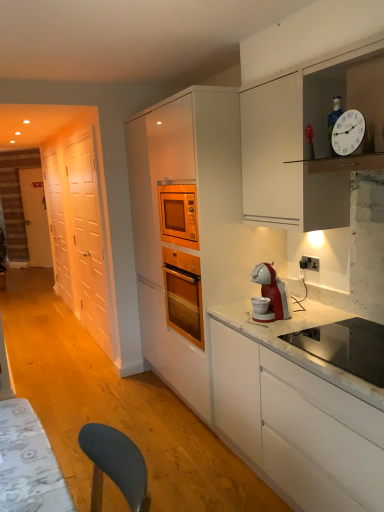
Measure the distance between stainless steel sink at lower right and camera.

stainless steel sink at lower right is 1.52 meters from camera.

At what (x,y) coordinates should I click in order to perform the action: click on white glossy door at left, the first glass door from the left. Please return your answer as a coordinate pair (x, y). This screenshot has height=512, width=384. Looking at the image, I should click on (57, 227).

What is the approximate height of white plastic clock at upper right?

It is 19.07 centimeters.

Identify the location of matte white cabinetry at center. The width and height of the screenshot is (384, 512). (199, 222).

Describe the element at coordinates (199, 222) in the screenshot. I see `matte white cabinetry at center` at that location.

Where is `stainless steel sink at lower right`? stainless steel sink at lower right is located at coordinates coord(346,346).

Is white wooden door at left facing towards white glossy door at left, marked as the first glass door in a front-to-back arrangement?

No, white wooden door at left is not aimed at white glossy door at left, marked as the first glass door in a front-to-back arrangement.

Which of these two, white wooden door at left or white glossy door at left, marked as the first glass door in a front-to-back arrangement, is smaller?

white glossy door at left, marked as the first glass door in a front-to-back arrangement, is smaller.

Is white wooden door at left not close to white glossy door at left, positioned as the 2th glass door in left-to-right order?

Indeed, white wooden door at left is not near white glossy door at left, positioned as the 2th glass door in left-to-right order.

Consider the image. Would you say stainless steel sink at lower right is inside or outside white wooden door at left?

stainless steel sink at lower right cannot be found inside white wooden door at left.

Is stainless steel sink at lower right facing away from white wooden door at left?

stainless steel sink at lower right is not turned away from white wooden door at left.

Would you consider stainless steel sink at lower right to be distant from white wooden door at left?

That's right, there is a large distance between stainless steel sink at lower right and white wooden door at left.

Consider the image. Between stainless steel sink at lower right and white wooden door at left, which one has less height?

Standing shorter between the two is stainless steel sink at lower right.

Can you confirm if white wooden door at left is positioned to the right of white plastic clock at upper right?

Incorrect, white wooden door at left is not on the right side of white plastic clock at upper right.

Is white wooden door at left far away from white plastic clock at upper right?

That's right, there is a large distance between white wooden door at left and white plastic clock at upper right.

Is white wooden door at left further to the viewer compared to white plastic clock at upper right?

Yes, it is.

Find the location of `door lying behind the white plastic clock at upper right`. door lying behind the white plastic clock at upper right is located at coordinates 35,217.

Which object is positioned more to the left, stainless steel sink at lower right or matte white cabinetry at center?

matte white cabinetry at center.

Looking at this image, could matte white cabinetry at center be considered to be inside stainless steel sink at lower right?

That's incorrect, matte white cabinetry at center is not inside stainless steel sink at lower right.

Can you tell me how much stainless steel sink at lower right and matte white cabinetry at center differ in facing direction?

There is a 0.85-degree angle between the facing directions of stainless steel sink at lower right and matte white cabinetry at center.

In terms of size, does stainless steel sink at lower right appear bigger or smaller than matte white cabinetry at center?

In the image, stainless steel sink at lower right appears to be smaller than matte white cabinetry at center.

Is white glossy door at left, the second glass door positioned from the front, further to the viewer compared to matte white cabinetry at center?

Yes, white glossy door at left, the second glass door positioned from the front, is further from the viewer.

Choose the correct answer: Is white glossy door at left, the first glass door from the left, inside matte white cabinetry at center or outside it?

white glossy door at left, the first glass door from the left, is not enclosed by matte white cabinetry at center.

Which is in front, point (67, 270) or point (186, 341)?

The point (186, 341) is more forward.

Which of these two, white glossy door at left, placed as the second glass door when sorted from right to left, or matte white cabinetry at center, stands shorter?

white glossy door at left, placed as the second glass door when sorted from right to left, is shorter.

From the image's perspective, who appears lower, white glossy door at left, placed as the second glass door when sorted from right to left, or white glossy door at left, positioned as the 2th glass door in left-to-right order?

white glossy door at left, positioned as the 2th glass door in left-to-right order, from the image's perspective.

Considering the positions of objects white glossy door at left, the first glass door from the left, and white glossy door at left, marked as the first glass door in a front-to-back arrangement, in the image provided, who is more to the left, white glossy door at left, the first glass door from the left, or white glossy door at left, marked as the first glass door in a front-to-back arrangement,?

white glossy door at left, the first glass door from the left, is more to the left.

In the scene shown: Is white glossy door at left, placed as the second glass door when sorted from right to left, turned away from white glossy door at left, marked as the first glass door in a front-to-back arrangement?

No, white glossy door at left, marked as the first glass door in a front-to-back arrangement, is not at the back of white glossy door at left, placed as the second glass door when sorted from right to left.

Can you tell me how much white glossy door at left, the second glass door positioned from the front, and white glossy door at left, marked as the first glass door in a front-to-back arrangement, differ in facing direction?

0.116 degrees separate the facing orientations of white glossy door at left, the second glass door positioned from the front, and white glossy door at left, marked as the first glass door in a front-to-back arrangement.

Is white glossy door at left, the first glass door from the left, oriented towards white plastic clock at upper right?

No, white glossy door at left, the first glass door from the left, is not facing towards white plastic clock at upper right.

From the image's perspective, which object appears higher, white glossy door at left, the first glass door when ordered from back to front, or white plastic clock at upper right?

From the image's view, white plastic clock at upper right is above.

Is white glossy door at left, the second glass door positioned from the front, completely or partially outside of white plastic clock at upper right?

white glossy door at left, the second glass door positioned from the front, lies outside white plastic clock at upper right's area.

The image size is (384, 512). What are the coordinates of `glass door that is the 2nd one below the white plastic clock at upper right (from a real-world perspective)` in the screenshot? It's located at (57, 227).

What are the coordinates of `the 2nd glass door below the white wooden door at left (from the image's perspective)` in the screenshot? It's located at (88, 237).

Identify the location of sink in front of the white wooden door at left. (346, 346).

Which object lies nearer to the anchor point white glossy door at left, the second glass door positioned from the front, white plastic clock at upper right or black plastic electrical outlet at upper right?

Based on the image, black plastic electrical outlet at upper right appears to be nearer to white glossy door at left, the second glass door positioned from the front.

Estimate the real-world distances between objects in this image. Which object is closer to white wooden door at left, white glossy door at left, marked as the first glass door in a front-to-back arrangement, or stainless steel sink at lower right?

white glossy door at left, marked as the first glass door in a front-to-back arrangement.

When comparing their distances from stainless steel sink at lower right, does white plastic clock at upper right or white glossy door at left, marked as the first glass door in a front-to-back arrangement, seem further?

Among the two, white glossy door at left, marked as the first glass door in a front-to-back arrangement, is located further to stainless steel sink at lower right.

Estimate the real-world distances between objects in this image. Which object is further from matte white cabinetry at center, white wooden door at left or white glossy door at left, the second glass door positioned from the front?

→ white wooden door at left is positioned further to the anchor matte white cabinetry at center.

When comparing their distances from white plastic clock at upper right, does white wooden door at left or black plastic electrical outlet at upper right seem closer?

Among the two, black plastic electrical outlet at upper right is located nearer to white plastic clock at upper right.

Considering their positions, is white plastic clock at upper right positioned closer to white wooden door at left than white glossy door at left, which ranks as the 2th glass door in back-to-front order?

white glossy door at left, which ranks as the 2th glass door in back-to-front order, is positioned closer to the anchor white wooden door at left.

When comparing their distances from matte white cabinetry at center, does stainless steel sink at lower right or white glossy door at left, which ranks as the 2th glass door in back-to-front order, seem further?

stainless steel sink at lower right is positioned further to the anchor matte white cabinetry at center.

Estimate the real-world distances between objects in this image. Which object is further from black plastic electrical outlet at upper right, white glossy door at left, which ranks as the 2th glass door in back-to-front order, or white glossy door at left, the second glass door positioned from the front?

white glossy door at left, the second glass door positioned from the front, is positioned further to the anchor black plastic electrical outlet at upper right.

At what (x,y) coordinates should I click in order to perform the action: click on clock positioned between stainless steel sink at lower right and white glossy door at left, the first glass door from the left, from near to far. Please return your answer as a coordinate pair (x, y). This screenshot has height=512, width=384. Looking at the image, I should click on (348, 132).

This screenshot has height=512, width=384. What are the coordinates of `clock located between white glossy door at left, positioned as the 2th glass door in left-to-right order, and black plastic electrical outlet at upper right in the left-right direction` in the screenshot? It's located at (348, 132).

Image resolution: width=384 pixels, height=512 pixels. In order to click on cabinetry positioned between white plastic clock at upper right and black plastic electrical outlet at upper right from near to far in this screenshot , I will do `click(199, 222)`.

I want to click on cabinetry between white plastic clock at upper right and white glossy door at left, the first glass door when ordered from back to front, from front to back, so click(199, 222).